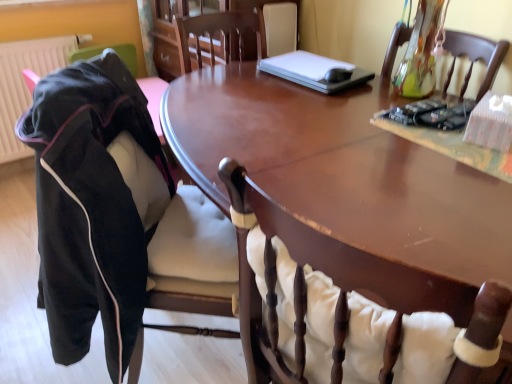
Question: Considering the relative sizes of suede-like black jacket at left, arranged as the first chair when viewed from the left, and white plastic laptop at upper center in the image provided, is suede-like black jacket at left, arranged as the first chair when viewed from the left, taller than white plastic laptop at upper center?

Choices:
 (A) yes
 (B) no

Answer: (A)

Question: Is suede-like black jacket at left, arranged as the first chair when viewed from the left, in front of white plastic laptop at upper center?

Choices:
 (A) yes
 (B) no

Answer: (A)

Question: Can you confirm if suede-like black jacket at left, which is the second chair from right to left, is thinner than white plastic laptop at upper center?

Choices:
 (A) no
 (B) yes

Answer: (A)

Question: From a real-world perspective, is suede-like black jacket at left, which is the second chair from right to left, positioned over white plastic laptop at upper center based on gravity?

Choices:
 (A) yes
 (B) no

Answer: (B)

Question: Could you tell me if suede-like black jacket at left, arranged as the first chair when viewed from the left, is facing white plastic laptop at upper center?

Choices:
 (A) no
 (B) yes

Answer: (A)

Question: From the image's perspective, is suede-like black jacket at left, arranged as the first chair when viewed from the left, located above white plastic laptop at upper center?

Choices:
 (A) no
 (B) yes

Answer: (A)

Question: Is wooden chair at center, which ranks as the 2th chair in left-to-right order, to the right of glossy wood table at center from the viewer's perspective?

Choices:
 (A) yes
 (B) no

Answer: (A)

Question: Does wooden chair at center, the first chair positioned from the right, have a lesser width compared to glossy wood table at center?

Choices:
 (A) no
 (B) yes

Answer: (B)

Question: From the image's perspective, is wooden chair at center, the first chair positioned from the right, located above glossy wood table at center?

Choices:
 (A) yes
 (B) no

Answer: (B)

Question: Is wooden chair at center, the first chair positioned from the right, positioned with its back to glossy wood table at center?

Choices:
 (A) no
 (B) yes

Answer: (B)

Question: From a real-world perspective, is wooden chair at center, the first chair positioned from the right, over glossy wood table at center?

Choices:
 (A) yes
 (B) no

Answer: (A)

Question: Is wooden chair at center, the first chair positioned from the right, further to the viewer compared to glossy wood table at center?

Choices:
 (A) yes
 (B) no

Answer: (B)

Question: Is wooden chair at center, which ranks as the 2th chair in left-to-right order, wider than white plastic laptop at upper center?

Choices:
 (A) no
 (B) yes

Answer: (B)